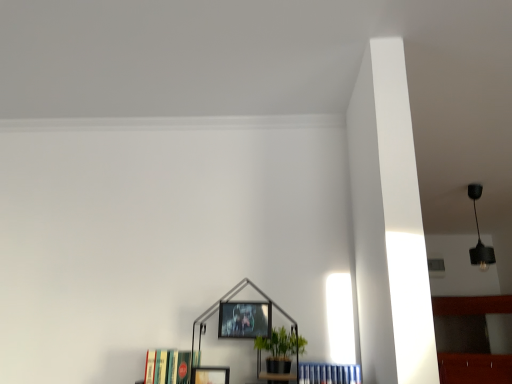
Question: Should I look upward or downward to see metallic silver picture frame at center, which is the second picture frame in left-to-right order?

Choices:
 (A) down
 (B) up

Answer: (A)

Question: Is hardcover books at lower left, the first book when ordered from left to right, in contact with green matte plant at center?

Choices:
 (A) no
 (B) yes

Answer: (A)

Question: From a real-world perspective, is hardcover books at lower left, the first book when ordered from left to right, located beneath green matte plant at center?

Choices:
 (A) no
 (B) yes

Answer: (B)

Question: Is hardcover books at lower left, the first book when ordered from left to right, looking in the opposite direction of green matte plant at center?

Choices:
 (A) no
 (B) yes

Answer: (A)

Question: Does hardcover books at lower left, the first book when ordered from left to right, have a greater height compared to green matte plant at center?

Choices:
 (A) no
 (B) yes

Answer: (A)

Question: From a real-world perspective, is hardcover books at lower left, which is the 2th book from right to left, on green matte plant at center?

Choices:
 (A) yes
 (B) no

Answer: (B)

Question: Is hardcover books at lower left, the first book when ordered from left to right, shorter than green matte plant at center?

Choices:
 (A) yes
 (B) no

Answer: (A)

Question: Is green matte plant at center smaller than blue hardcover books at lower center, which ranks as the first book in right-to-left order?

Choices:
 (A) no
 (B) yes

Answer: (A)

Question: Is blue hardcover books at lower center, which ranks as the first book in right-to-left order, at the back of green matte plant at center?

Choices:
 (A) yes
 (B) no

Answer: (B)

Question: Is blue hardcover books at lower center, marked as the second book in a left-to-right arrangement, surrounded by green matte plant at center?

Choices:
 (A) yes
 (B) no

Answer: (B)

Question: Is the depth of green matte plant at center less than that of blue hardcover books at lower center, which ranks as the first book in right-to-left order?

Choices:
 (A) no
 (B) yes

Answer: (A)

Question: From a real-world perspective, is green matte plant at center below blue hardcover books at lower center, which ranks as the first book in right-to-left order?

Choices:
 (A) yes
 (B) no

Answer: (B)

Question: Does green matte plant at center turn towards blue hardcover books at lower center, which ranks as the first book in right-to-left order?

Choices:
 (A) no
 (B) yes

Answer: (A)

Question: Would you say green matte plant at center is part of black matte pendant light at upper right's contents?

Choices:
 (A) yes
 (B) no

Answer: (B)